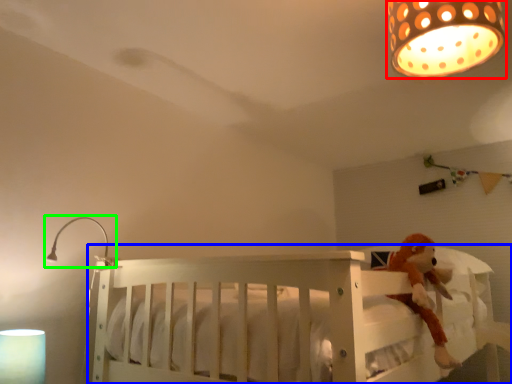
Question: Which object is positioned farthest from lamp (highlighted by a red box)? Select from infant bed (highlighted by a blue box) and lamp (highlighted by a green box).

Choices:
 (A) infant bed
 (B) lamp

Answer: (B)